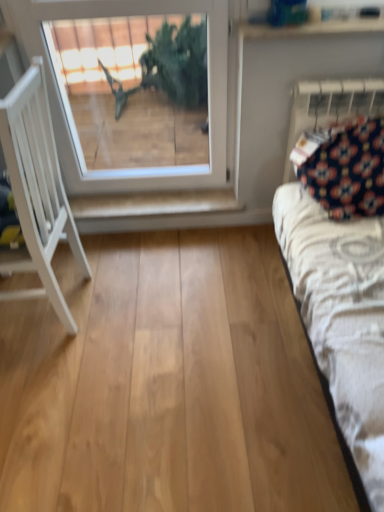
Where is `vacant area that is situated to the right of white wood chair at left`? vacant area that is situated to the right of white wood chair at left is located at coordinates (144, 296).